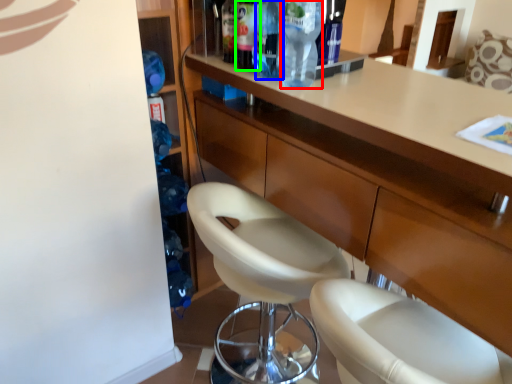
Question: Which object is the closest to the bottle (highlighted by a red box)? Choose among these: bottle (highlighted by a blue box) or bottle (highlighted by a green box).

Choices:
 (A) bottle
 (B) bottle

Answer: (A)